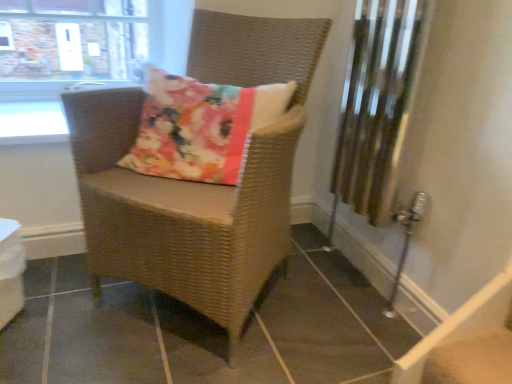
What is the approximate width of woven brown chair at center?

23.73 inches.

The height and width of the screenshot is (384, 512). What do you see at coordinates (11, 270) in the screenshot? I see `white glossy table at lower left` at bounding box center [11, 270].

Locate an element on the screen. Image resolution: width=512 pixels, height=384 pixels. white glossy window sill at upper left is located at coordinates (32, 123).

In order to face white glossy window sill at upper left, should I rotate leftwards or rightwards?

You should rotate left by 28.119 degrees.

Where is `clear glass window at upper left`? clear glass window at upper left is located at coordinates (70, 44).

At what (x,y) coordinates should I click in order to perform the action: click on woven brown chair at center. Please return your answer as a coordinate pair (x, y). This screenshot has height=384, width=512. Looking at the image, I should click on (198, 183).

From a real-world perspective, between clear glass window at upper left and white glossy table at lower left, who is vertically higher?

clear glass window at upper left.

How different are the orientations of clear glass window at upper left and white glossy table at lower left in degrees?

There is a 30-degree angle between the facing directions of clear glass window at upper left and white glossy table at lower left.

Would you say clear glass window at upper left is a long distance from white glossy table at lower left?

No, there isn't a large distance between clear glass window at upper left and white glossy table at lower left.

From the image's perspective, between clear glass window at upper left and white glossy table at lower left, who is located below?

white glossy table at lower left.

From a real-world perspective, who is located higher, woven brown chair at center or white glossy window sill at upper left?

white glossy window sill at upper left, from a real-world perspective.

Is woven brown chair at center bigger than white glossy window sill at upper left?

Indeed, woven brown chair at center has a larger size compared to white glossy window sill at upper left.

Does woven brown chair at center touch white glossy window sill at upper left?

They are not placed beside each other.

The height and width of the screenshot is (384, 512). What are the coordinates of `chair that is in front of the white glossy window sill at upper left` in the screenshot? It's located at (198, 183).

In terms of size, does white glossy window sill at upper left appear bigger or smaller than clear glass window at upper left?

In the image, white glossy window sill at upper left appears to be smaller than clear glass window at upper left.

Is white glossy window sill at upper left facing towards clear glass window at upper left?

No, white glossy window sill at upper left does not turn towards clear glass window at upper left.

From a real-world perspective, between white glossy window sill at upper left and clear glass window at upper left, who is vertically higher?

From a 3D spatial view, clear glass window at upper left is above.

Is woven brown chair at center behind clear glass window at upper left?

No, the depth of woven brown chair at center is less than that of clear glass window at upper left.

Are woven brown chair at center and clear glass window at upper left making contact?

No, woven brown chair at center is not touching clear glass window at upper left.

Considering the relative sizes of woven brown chair at center and clear glass window at upper left in the image provided, is woven brown chair at center wider than clear glass window at upper left?

Yes.

How far apart are woven brown chair at center and clear glass window at upper left?

woven brown chair at center is 89.78 centimeters away from clear glass window at upper left.

Does point (0, 269) come behind point (59, 38)?

No, it is in front of (59, 38).

How different are the orientations of white glossy table at lower left and clear glass window at upper left in degrees?

There is a 30-degree angle between the facing directions of white glossy table at lower left and clear glass window at upper left.

Considering the sizes of objects white glossy table at lower left and clear glass window at upper left in the image provided, who is bigger, white glossy table at lower left or clear glass window at upper left?

Bigger between the two is clear glass window at upper left.

Is white glossy table at lower left aimed at clear glass window at upper left?

No, white glossy table at lower left is not aimed at clear glass window at upper left.

Is woven brown chair at center smaller than white glossy table at lower left?

No.

Is woven brown chair at center shorter than white glossy table at lower left?

No.

Is white glossy table at lower left located within woven brown chair at center?

Actually, white glossy table at lower left is outside woven brown chair at center.

From the image's perspective, would you say woven brown chair at center is shown under white glossy table at lower left?

Actually, woven brown chair at center appears above white glossy table at lower left in the image.

Does clear glass window at upper left have a smaller size compared to white glossy window sill at upper left?

No, clear glass window at upper left is not smaller than white glossy window sill at upper left.

Looking at their sizes, would you say clear glass window at upper left is wider or thinner than white glossy window sill at upper left?

In the image, clear glass window at upper left appears to be more narrow than white glossy window sill at upper left.

Is clear glass window at upper left surrounding white glossy window sill at upper left?

No, white glossy window sill at upper left is not surrounded by clear glass window at upper left.

Considering the sizes of objects clear glass window at upper left and white glossy window sill at upper left in the image provided, who is taller, clear glass window at upper left or white glossy window sill at upper left?

With more height is clear glass window at upper left.

Where is `window located on the right of white glossy table at lower left`? This screenshot has height=384, width=512. window located on the right of white glossy table at lower left is located at coordinates (70, 44).

Find the location of a particular element. This screenshot has width=512, height=384. chair in front of the white glossy window sill at upper left is located at coordinates (198, 183).

When comparing their distances from woven brown chair at center, does clear glass window at upper left or white glossy window sill at upper left seem further?

Based on the image, clear glass window at upper left appears to be further to woven brown chair at center.

Based on their spatial positions, is white glossy window sill at upper left or clear glass window at upper left further from white glossy table at lower left?

clear glass window at upper left.

Based on their spatial positions, is white glossy table at lower left or white glossy window sill at upper left closer to woven brown chair at center?

Based on the image, white glossy table at lower left appears to be nearer to woven brown chair at center.

Which object lies further to the anchor point white glossy window sill at upper left, clear glass window at upper left or woven brown chair at center?

woven brown chair at center lies further to white glossy window sill at upper left than the other object.

Based on their spatial positions, is white glossy table at lower left or woven brown chair at center further from clear glass window at upper left?

white glossy table at lower left.

Based on their spatial positions, is woven brown chair at center or clear glass window at upper left further from white glossy window sill at upper left?

woven brown chair at center is positioned further to the anchor white glossy window sill at upper left.

From the image, which object appears to be nearer to white glossy window sill at upper left, white glossy table at lower left or clear glass window at upper left?

clear glass window at upper left is positioned closer to the anchor white glossy window sill at upper left.

Estimate the real-world distances between objects in this image. Which object is closer to white glossy table at lower left, woven brown chair at center or white glossy window sill at upper left?

Among the two, white glossy window sill at upper left is located nearer to white glossy table at lower left.

The image size is (512, 384). I want to click on window sill between woven brown chair at center and clear glass window at upper left along the z-axis, so pos(32,123).

Where is `chair between clear glass window at upper left and white glossy table at lower left in the vertical direction`? Image resolution: width=512 pixels, height=384 pixels. chair between clear glass window at upper left and white glossy table at lower left in the vertical direction is located at coordinates (198, 183).

Where is `table between white glossy window sill at upper left and woven brown chair at center in the horizontal direction`? The image size is (512, 384). table between white glossy window sill at upper left and woven brown chair at center in the horizontal direction is located at coordinates (11, 270).

What are the coordinates of `window sill that lies between clear glass window at upper left and white glossy table at lower left from top to bottom` in the screenshot? It's located at (32, 123).